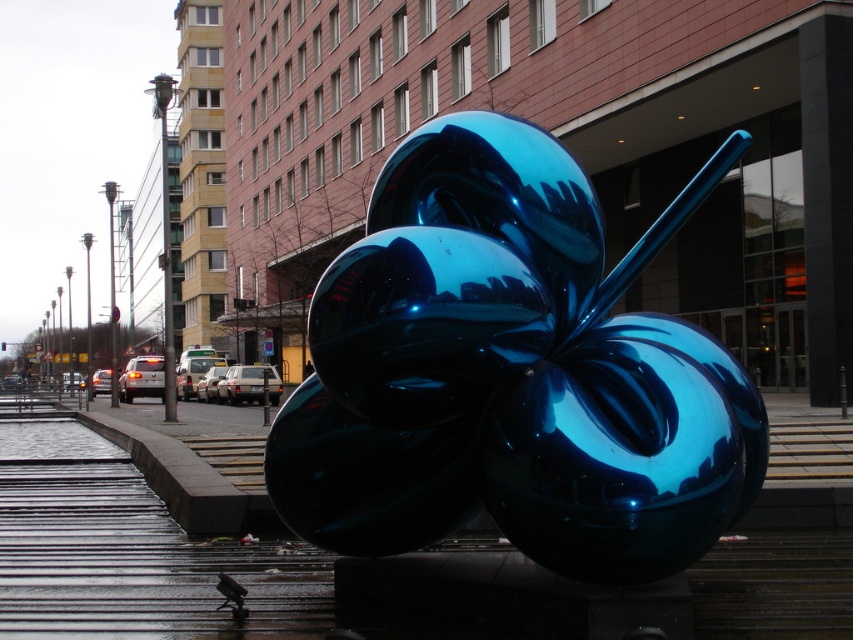
Question: Among these objects, which one is farthest from the camera?

Choices:
 (A) glossy concrete pavement at center
 (B) glossy metallic sculpture at center

Answer: (A)

Question: Among these points, which one is nearest to the camera?

Choices:
 (A) (296, 490)
 (B) (271, 618)

Answer: (B)

Question: Which of the following is the farthest from the observer?

Choices:
 (A) glossy metallic sculpture at center
 (B) glossy concrete pavement at center

Answer: (B)

Question: Does glossy metallic sculpture at center come behind glossy concrete pavement at center?

Choices:
 (A) yes
 (B) no

Answer: (B)

Question: Can you confirm if glossy metallic sculpture at center is positioned to the right of glossy concrete pavement at center?

Choices:
 (A) yes
 (B) no

Answer: (A)

Question: Is glossy metallic sculpture at center smaller than glossy concrete pavement at center?

Choices:
 (A) no
 (B) yes

Answer: (B)